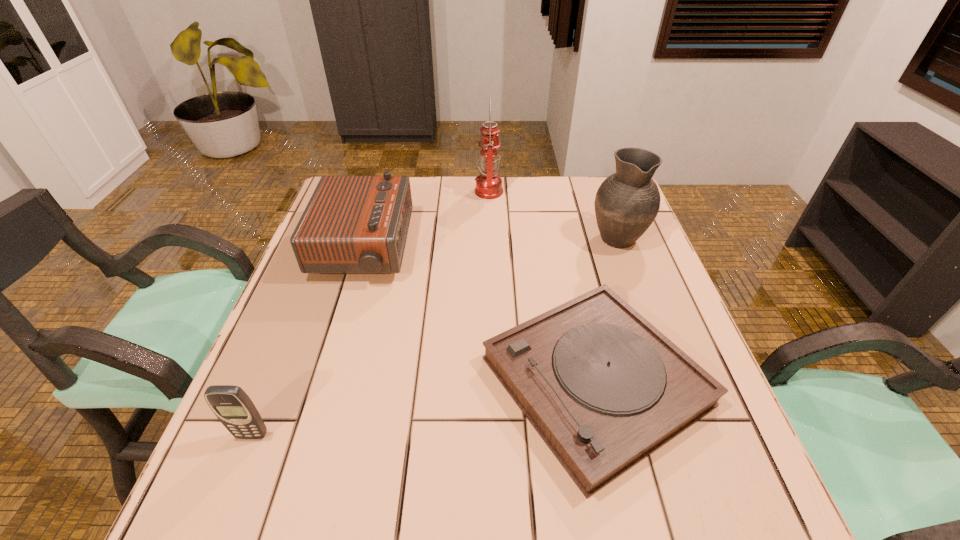
Identify the location of oil lamp. The width and height of the screenshot is (960, 540). (489, 184).

Identify the location of the tallest object. (489, 184).

I want to click on the second tallest object, so click(x=627, y=202).

The height and width of the screenshot is (540, 960). I want to click on radio receiver, so click(352, 224).

The image size is (960, 540). I want to click on cellular telephone, so click(x=232, y=406).

Identify the location of phonograph record. Image resolution: width=960 pixels, height=540 pixels. (604, 388).

Image resolution: width=960 pixels, height=540 pixels. In order to click on free point located 0.260m on the left of the tallest object in this screenshot , I will do `click(393, 191)`.

Find the location of a particular element. The image size is (960, 540). blank area located on the side of the pitcher with the handle is located at coordinates (599, 189).

The width and height of the screenshot is (960, 540). Identify the location of blank space located 0.240m on the side of the pitcher with the handle. (594, 177).

The width and height of the screenshot is (960, 540). Find the location of `free space located on the side of the pitcher with the handle`. free space located on the side of the pitcher with the handle is located at coordinates (603, 200).